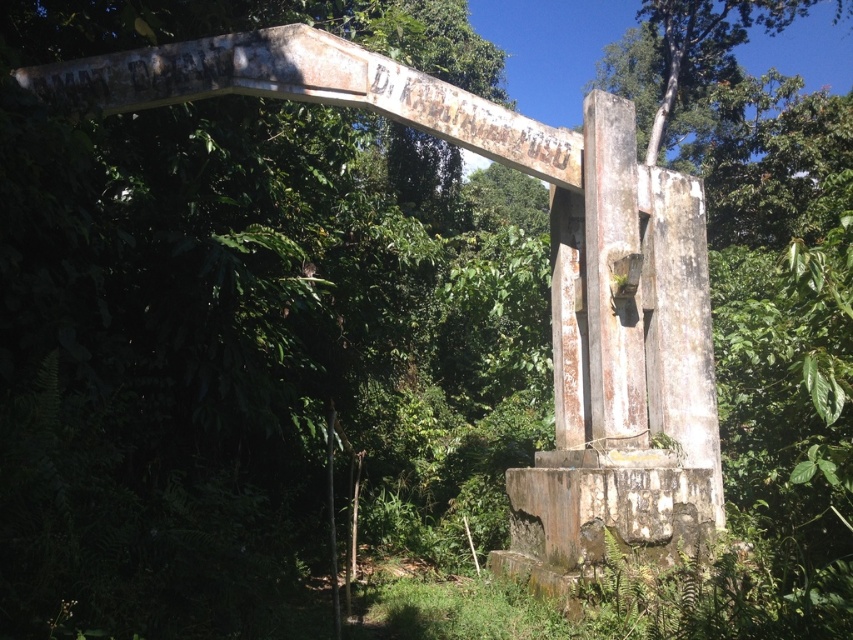
You are a hiker who has stumbled upon this archway in the forest. You notice the rusty concrete monument at center and the green leafy tree at upper center. Which object would block your view more if you were standing directly in front of the monument?

The rusty concrete monument at center is larger in size than the green leafy tree at upper center, so it would block your view more when standing directly in front of it.

You are a hiker trying to take a photo of the rusty concrete monument at center and the green leafy tree at upper center. To ensure both are fully visible in the frame, which object should you position closer to the camera?

The rusty concrete monument at center might be wider than green leafy tree at upper center, so you should position the rusty concrete monument at center closer to the camera to ensure it fits within the frame.